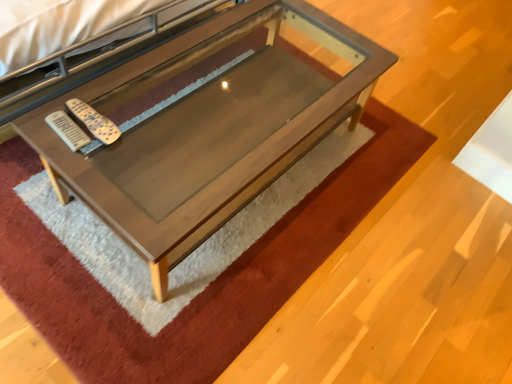
Question: Can you confirm if white plastic remote at center-left, which is the 2th remote from left to right, is positioned to the left of white plastic remote at left, marked as the second remote in a right-to-left arrangement?

Choices:
 (A) yes
 (B) no

Answer: (B)

Question: Is there a large distance between white plastic remote at center-left, which is the 2th remote from left to right, and white plastic remote at left, marked as the second remote in a right-to-left arrangement?

Choices:
 (A) yes
 (B) no

Answer: (B)

Question: Does white plastic remote at center-left, which is the 2th remote from left to right, turn towards white plastic remote at left, marked as the second remote in a right-to-left arrangement?

Choices:
 (A) yes
 (B) no

Answer: (B)

Question: Considering the relative sizes of white plastic remote at center-left, which is the 2th remote from left to right, and white plastic remote at left, placed as the 1th remote when sorted from left to right, in the image provided, is white plastic remote at center-left, which is the 2th remote from left to right, smaller than white plastic remote at left, placed as the 1th remote when sorted from left to right,?

Choices:
 (A) yes
 (B) no

Answer: (B)

Question: Does white plastic remote at center-left, placed as the 1th remote when sorted from right to left, have a greater width compared to white plastic remote at left, marked as the second remote in a right-to-left arrangement?

Choices:
 (A) no
 (B) yes

Answer: (B)

Question: Are white plastic remote at center-left, placed as the 1th remote when sorted from right to left, and white plastic remote at left, marked as the second remote in a right-to-left arrangement, beside each other?

Choices:
 (A) yes
 (B) no

Answer: (A)

Question: Is white plastic remote at left, marked as the second remote in a right-to-left arrangement, taller than wooden table at center?

Choices:
 (A) no
 (B) yes

Answer: (A)

Question: Is white plastic remote at left, marked as the second remote in a right-to-left arrangement, bigger than wooden table at center?

Choices:
 (A) no
 (B) yes

Answer: (A)

Question: Is white plastic remote at left, placed as the 1th remote when sorted from left to right, turned away from wooden table at center?

Choices:
 (A) no
 (B) yes

Answer: (B)

Question: Is wooden table at center a part of white plastic remote at left, placed as the 1th remote when sorted from left to right?

Choices:
 (A) no
 (B) yes

Answer: (A)

Question: From the image's perspective, is white plastic remote at left, marked as the second remote in a right-to-left arrangement, located above wooden table at center?

Choices:
 (A) no
 (B) yes

Answer: (A)

Question: Is white plastic remote at left, placed as the 1th remote when sorted from left to right, not within wooden table at center?

Choices:
 (A) no
 (B) yes

Answer: (A)

Question: Considering the relative sizes of wooden table at center and white plastic remote at center-left, placed as the 1th remote when sorted from right to left, in the image provided, is wooden table at center bigger than white plastic remote at center-left, placed as the 1th remote when sorted from right to left,?

Choices:
 (A) yes
 (B) no

Answer: (A)